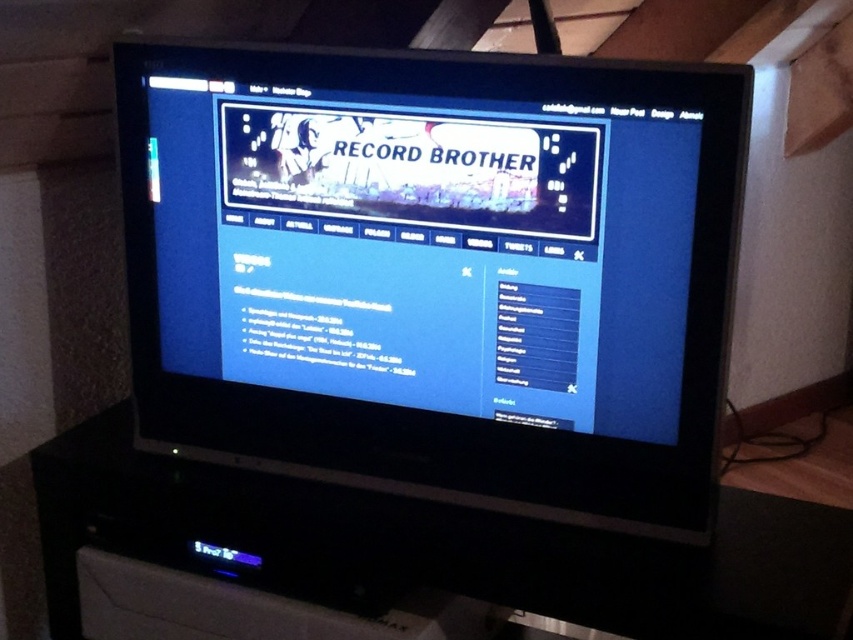
Who is more forward, (x=651, y=118) or (x=376, y=602)?

Point (x=651, y=118)

I want to click on black glossy monitor at center, so click(436, 272).

The width and height of the screenshot is (853, 640). In order to click on black glossy monitor at center in this screenshot , I will do click(436, 272).

Locate an element on the screen. The height and width of the screenshot is (640, 853). black glossy monitor at center is located at coordinates (436, 272).